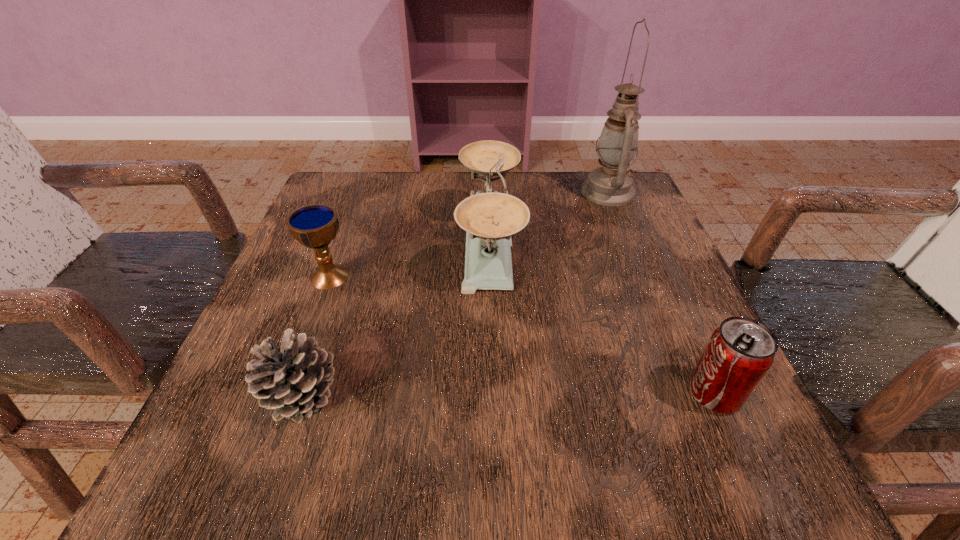
The image size is (960, 540). In order to click on blank area located on the back of the chalice in this screenshot , I will do `click(348, 228)`.

Where is `vacant space located 0.280m on the back of the pop soda`? Image resolution: width=960 pixels, height=540 pixels. vacant space located 0.280m on the back of the pop soda is located at coordinates (652, 255).

You are a GUI agent. You are given a task and a screenshot of the screen. Output one action in this format:
    pyautogui.click(x=<x>, y=<y>)
    Task: Click on the vacant region located 0.050m on the back of the pinecone
    
    Given the screenshot: What is the action you would take?
    pyautogui.click(x=322, y=339)

Identify the location of oil lamp positioned at the far edge. Image resolution: width=960 pixels, height=540 pixels. (611, 184).

I want to click on scale that is at the far edge, so click(489, 218).

You are a GUI agent. You are given a task and a screenshot of the screen. Output one action in this format:
    pyautogui.click(x=<x>, y=<y>)
    Task: Click on the object located at the near edge
    
    Given the screenshot: What is the action you would take?
    pyautogui.click(x=294, y=380)

Where is `chalice that is at the left edge`? The image size is (960, 540). chalice that is at the left edge is located at coordinates click(314, 226).

This screenshot has height=540, width=960. Find the location of `pinecone located at the left edge`. pinecone located at the left edge is located at coordinates (294, 380).

The width and height of the screenshot is (960, 540). What are the coordinates of `oil lamp that is at the right edge` in the screenshot? It's located at (611, 184).

Where is `pop soda that is at the right edge`? This screenshot has width=960, height=540. pop soda that is at the right edge is located at coordinates (739, 353).